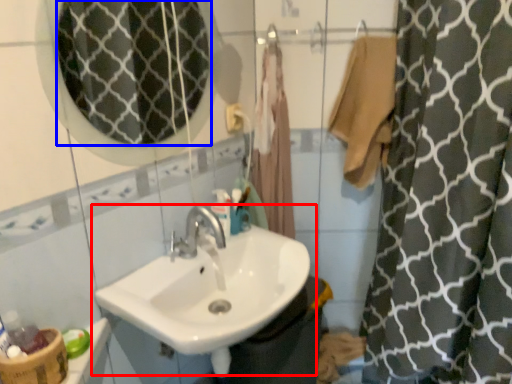
Question: Which object appears closest to the camera in this image, sink (highlighted by a red box) or mirror (highlighted by a blue box)?

Choices:
 (A) sink
 (B) mirror

Answer: (B)